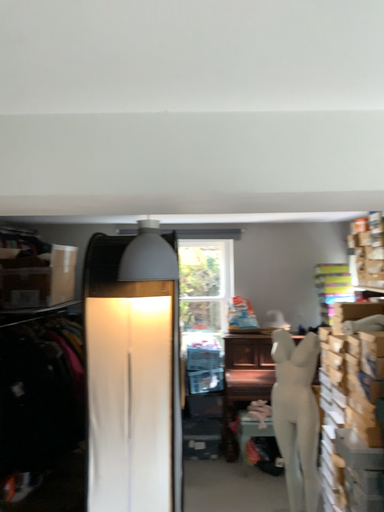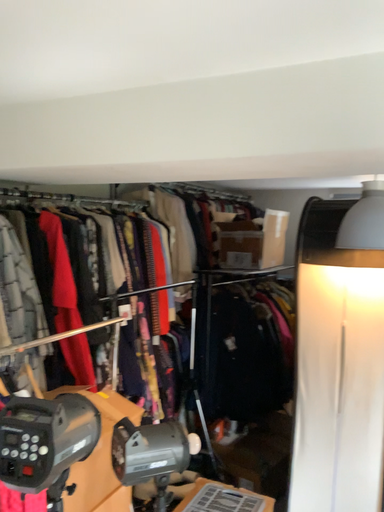
Question: Which way did the camera rotate in the video?

Choices:
 (A) rotated right
 (B) rotated left

Answer: (B)